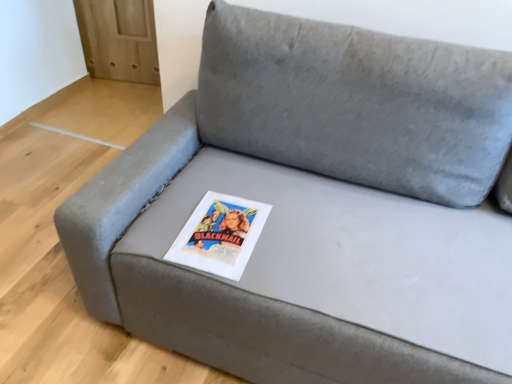
Where is `vacant space situated above matte paper poster at center (from a real-world perspective)`? Image resolution: width=512 pixels, height=384 pixels. vacant space situated above matte paper poster at center (from a real-world perspective) is located at coordinates (222, 228).